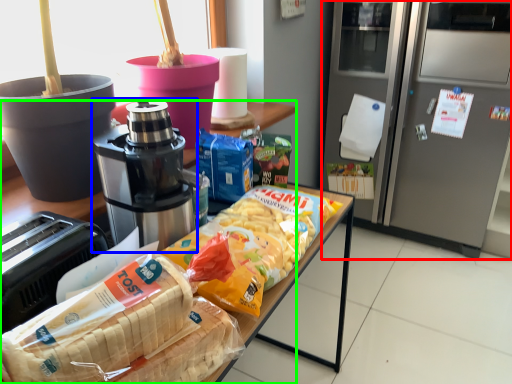
Question: Considering the real-world distances, which object is closest to home appliance (highlighted by a red box)? coffee maker (highlighted by a blue box) or cabinetry (highlighted by a green box).

Choices:
 (A) coffee maker
 (B) cabinetry

Answer: (A)